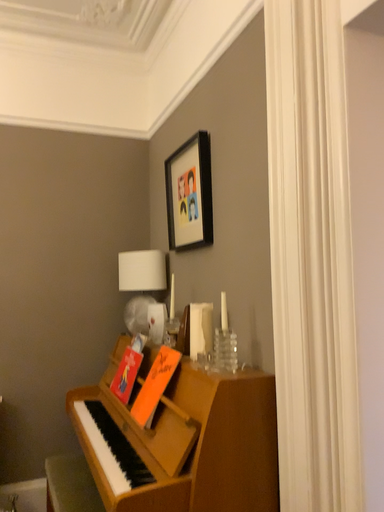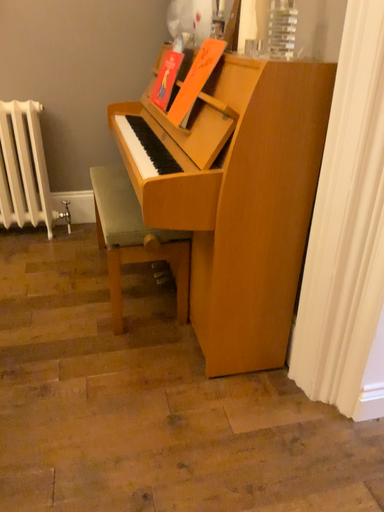
Question: How did the camera likely rotate when shooting the video?

Choices:
 (A) rotated left
 (B) rotated right

Answer: (A)